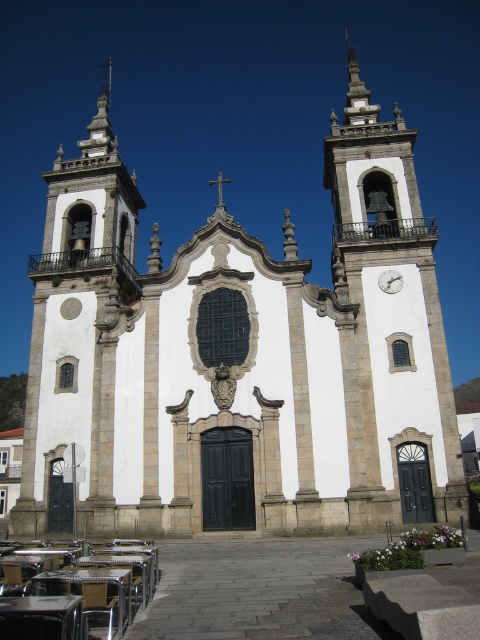
Which is below, white stone clock tower at upper center or metallic silver clock at upper right?

metallic silver clock at upper right is lower down.

From the picture: Does white stone clock tower at upper center appear over metallic silver clock at upper right?

Yes, white stone clock tower at upper center is above metallic silver clock at upper right.

The width and height of the screenshot is (480, 640). Find the location of `white stone clock tower at upper center`. white stone clock tower at upper center is located at coordinates (392, 310).

Who is taller, white stone clock tower at upper center or white stone bell tower at left?

white stone clock tower at upper center

Can you confirm if white stone clock tower at upper center is taller than white stone bell tower at left?

Yes, white stone clock tower at upper center is taller than white stone bell tower at left.

Is point (432, 284) positioned after point (76, 188)?

That is False.

I want to click on white stone clock tower at upper center, so click(392, 310).

From the picture: Is white stone bell tower at left shorter than metallic silver clock at upper right?

Incorrect, white stone bell tower at left's height does not fall short of metallic silver clock at upper right's.

Can you confirm if white stone bell tower at left is positioned below metallic silver clock at upper right?

Incorrect, white stone bell tower at left is not positioned below metallic silver clock at upper right.

Is point (59, 348) less distant than point (396, 291)?

No, it is behind (396, 291).

Identify the location of white stone bell tower at left. The height and width of the screenshot is (640, 480). (78, 323).